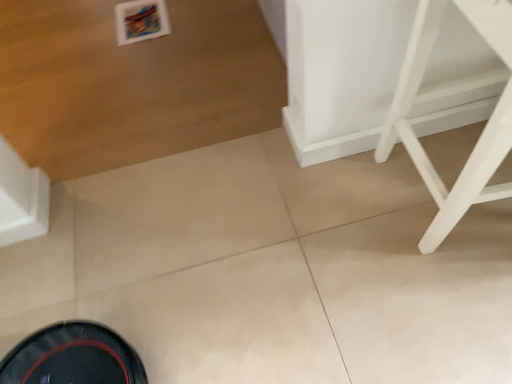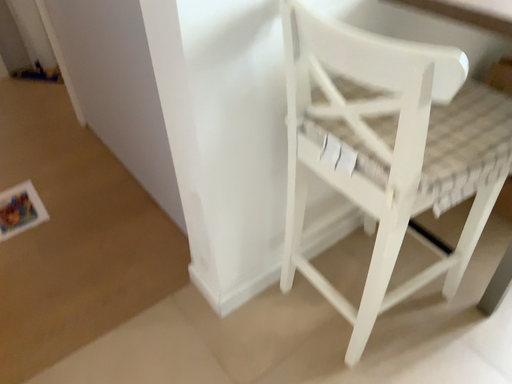
Question: How did the camera likely rotate when shooting the video?

Choices:
 (A) rotated upward
 (B) rotated downward

Answer: (A)